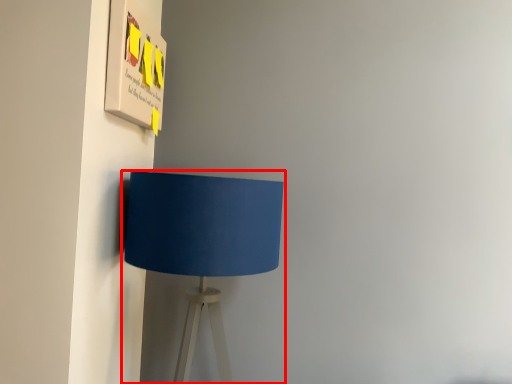
Question: Considering the relative positions of lamp (annotated by the red box) and poster in the image provided, where is lamp (annotated by the red box) located with respect to the staircase?

Choices:
 (A) right
 (B) left

Answer: (A)